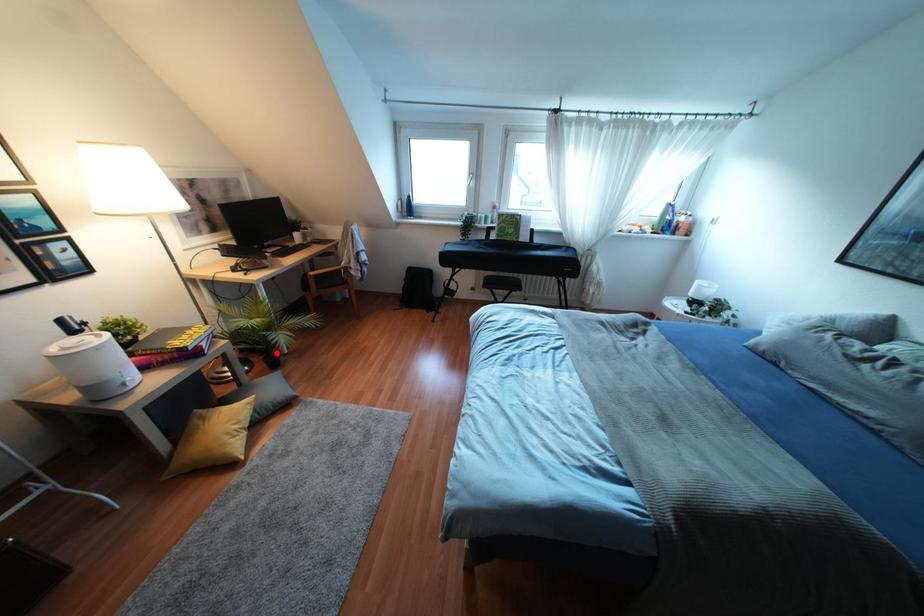
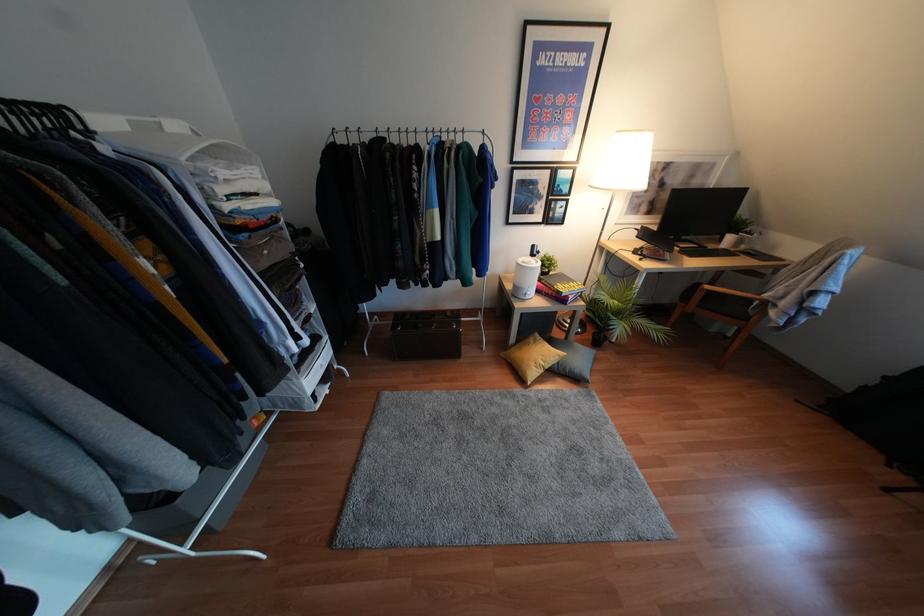
Question: I am providing you with two images of the same scene from different viewpoints. A red point is marked on the first image. At the location where the point appears in image 1, is it still visible in image 2?

Choices:
 (A) Yes
 (B) No

Answer: (A)